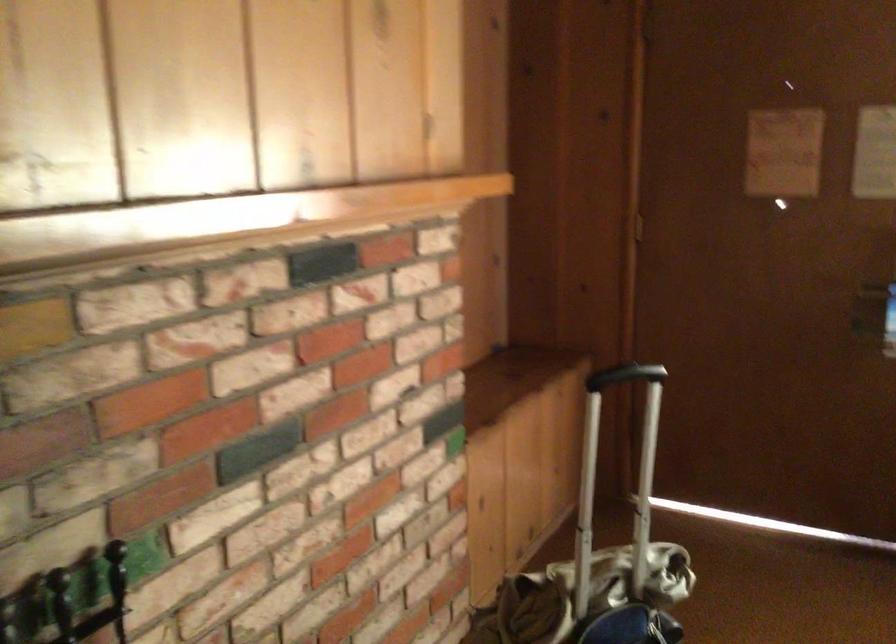
Image resolution: width=896 pixels, height=644 pixels. What do you see at coordinates (625, 375) in the screenshot?
I see `the black luggage handle` at bounding box center [625, 375].